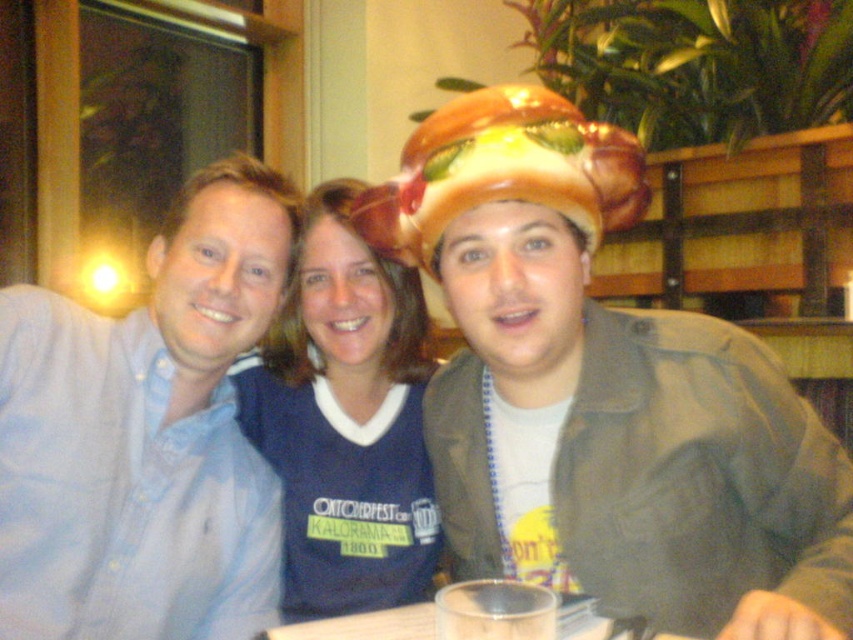
Question: Which of the following is the closest to the observer?

Choices:
 (A) matte plastic burger hat at center
 (B) light blue button-down shirt at left
 (C) transparent plastic cup at center
 (D) blue jersey at center

Answer: (C)

Question: Which object appears farthest from the camera in this image?

Choices:
 (A) transparent plastic cup at center
 (B) blue jersey at center

Answer: (B)

Question: Can you confirm if light blue button-down shirt at left is positioned above blue jersey at center?

Choices:
 (A) yes
 (B) no

Answer: (A)

Question: Which object appears farthest from the camera in this image?

Choices:
 (A) matte plastic burger hat at center
 (B) transparent plastic cup at center
 (C) blue jersey at center
 (D) light blue button-down shirt at left

Answer: (C)

Question: Does matte plastic burger hat at center lie behind transparent plastic cup at center?

Choices:
 (A) yes
 (B) no

Answer: (A)

Question: Does matte plastic burger hat at center appear on the right side of blue jersey at center?

Choices:
 (A) yes
 (B) no

Answer: (A)